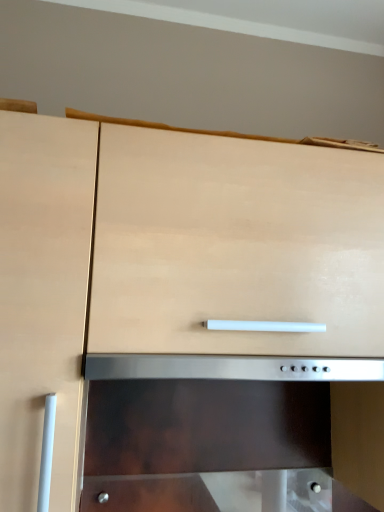
Locate an element on the screen. satin silver vent at center is located at coordinates (231, 368).

The width and height of the screenshot is (384, 512). What do you see at coordinates (231, 368) in the screenshot? I see `satin silver vent at center` at bounding box center [231, 368].

Measure the distance between point [255,372] and camera.

A distance of 35.83 inches exists between point [255,372] and camera.

Identify the location of satin silver vent at center. This screenshot has width=384, height=512. (231, 368).